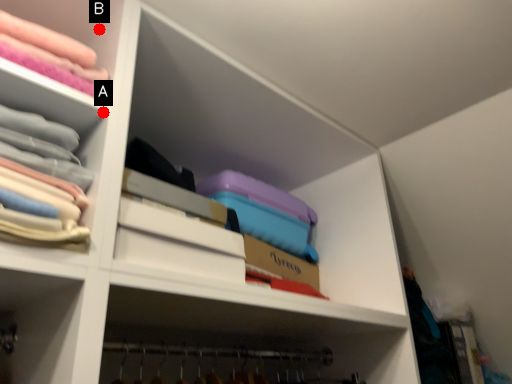
Question: Two points are circled on the image, labeled by A and B beside each circle. Which point is farther to the camera?

Choices:
 (A) A is further
 (B) B is further

Answer: (B)